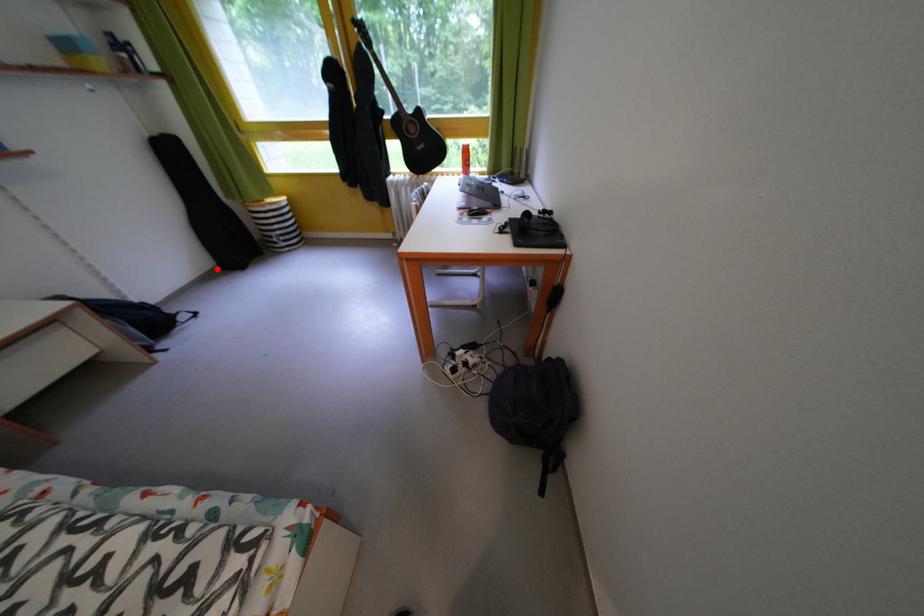
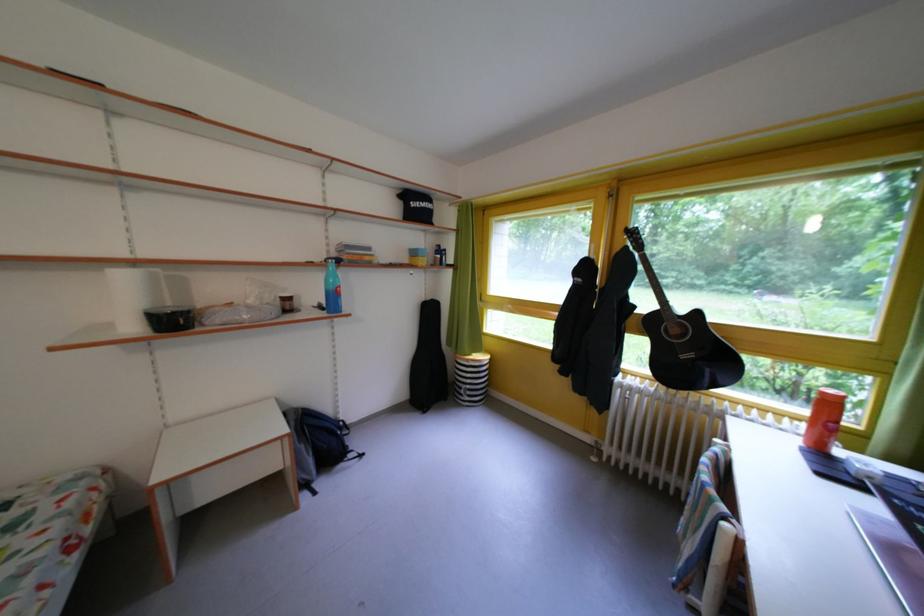
In the second image, find the point that corresponds to the highlighted location in the first image.

(415, 400)